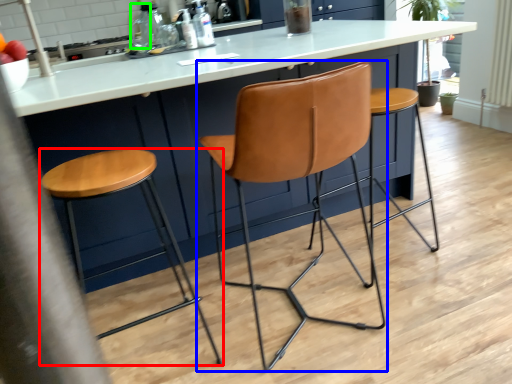
Question: Which object is the farthest from stool (highlighted by a red box)? Choose among these: chair (highlighted by a blue box) or bottle (highlighted by a green box).

Choices:
 (A) chair
 (B) bottle

Answer: (B)